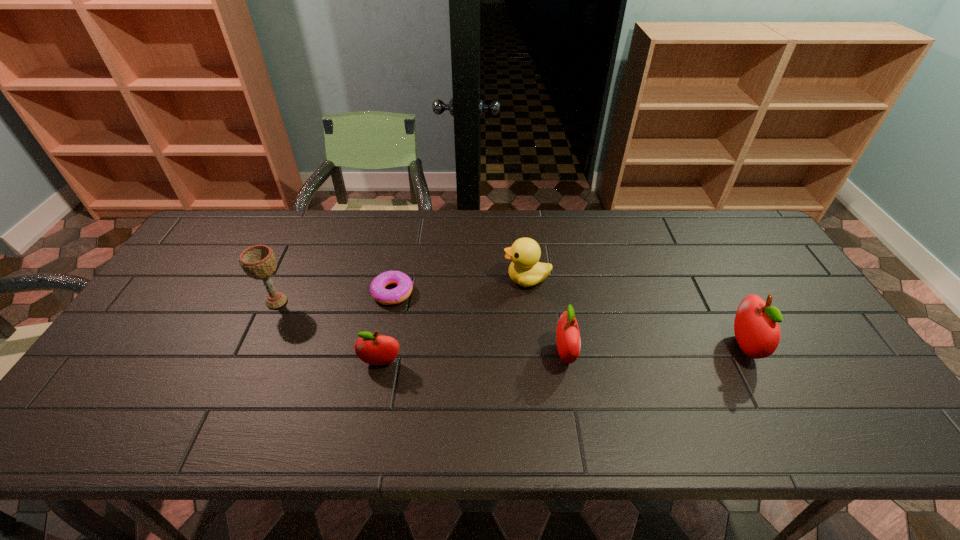
Locate an element on the screen. This screenshot has width=960, height=540. free space located 0.310m on the right of the shortest object is located at coordinates (520, 292).

I want to click on vacant position located on the left of the chalice, so click(x=209, y=302).

The width and height of the screenshot is (960, 540). In order to click on free region located on the face of the duck in this screenshot , I will do `click(412, 279)`.

Identify the location of vacant region located on the face of the duck. This screenshot has height=540, width=960. (443, 279).

The height and width of the screenshot is (540, 960). What are the coordinates of `vacant space located on the face of the duck` in the screenshot? It's located at (486, 279).

The image size is (960, 540). I want to click on free space at the far edge of the desktop, so click(x=530, y=224).

In the image, there is a desktop. At what (x,y) coordinates should I click in order to perform the action: click on free region at the near edge. Please return your answer as a coordinate pair (x, y). Looking at the image, I should click on (285, 380).

The height and width of the screenshot is (540, 960). What are the coordinates of `free space at the left edge of the desktop` in the screenshot? It's located at (179, 274).

The image size is (960, 540). In order to click on vacant space at the right edge of the desktop in this screenshot , I will do pyautogui.click(x=788, y=296).

Identify the location of blank space at the far right corner of the desktop. The height and width of the screenshot is (540, 960). (737, 246).